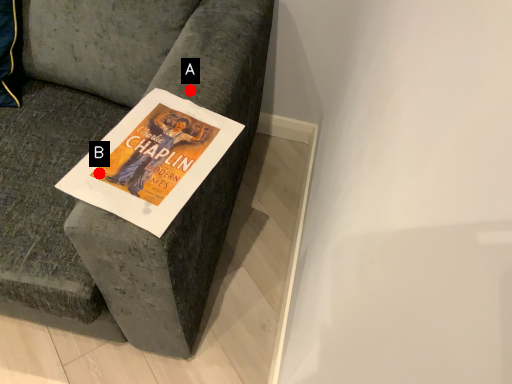
Question: Two points are circled on the image, labeled by A and B beside each circle. Which point appears farthest from the camera in this image?

Choices:
 (A) A is further
 (B) B is further

Answer: (A)